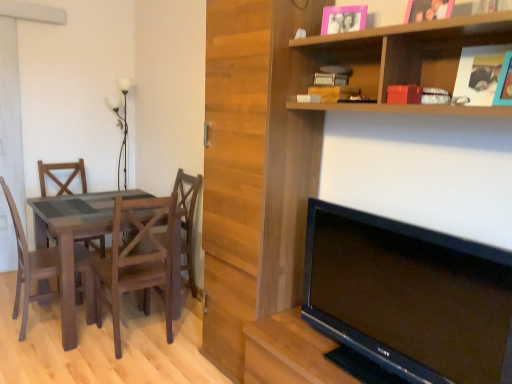
Question: From the image's perspective, does wooden textured chair at left, positioned as the 2th chair in right-to-left order, appear higher than wooden shelf at upper right?

Choices:
 (A) yes
 (B) no

Answer: (B)

Question: From the image's perspective, does wooden textured chair at left, positioned as the 2th chair in right-to-left order, appear lower than wooden shelf at upper right?

Choices:
 (A) yes
 (B) no

Answer: (A)

Question: Could you tell me if wooden textured chair at left, acting as the second chair starting from the left, is facing wooden shelf at upper right?

Choices:
 (A) yes
 (B) no

Answer: (B)

Question: From a real-world perspective, is wooden textured chair at left, acting as the second chair starting from the left, positioned under wooden shelf at upper right based on gravity?

Choices:
 (A) no
 (B) yes

Answer: (B)

Question: Is wooden textured chair at left, acting as the second chair starting from the left, to the left of wooden shelf at upper right from the viewer's perspective?

Choices:
 (A) yes
 (B) no

Answer: (A)

Question: Is point (162, 216) positioned closer to the camera than point (325, 28)?

Choices:
 (A) farther
 (B) closer

Answer: (A)

Question: Is wooden textured chair at left, positioned as the 2th chair in right-to-left order, inside or outside of pink plastic picture frame at upper center, which is counted as the first picture frame, starting from the back?

Choices:
 (A) outside
 (B) inside

Answer: (A)

Question: From the image's perspective, is wooden textured chair at left, positioned as the 2th chair in right-to-left order, above or below pink plastic picture frame at upper center, positioned as the 2th picture frame in front-to-back order?

Choices:
 (A) above
 (B) below

Answer: (B)

Question: Considering their positions, is wooden textured chair at left, positioned as the 2th chair in right-to-left order, located in front of or behind pink plastic picture frame at upper center, positioned as the 2th picture frame in front-to-back order?

Choices:
 (A) behind
 (B) front

Answer: (A)

Question: Considering their positions, is wooden shelf at upper right located in front of or behind white glass lamp at upper left?

Choices:
 (A) behind
 (B) front

Answer: (B)

Question: From the image's perspective, is wooden shelf at upper right above or below white glass lamp at upper left?

Choices:
 (A) below
 (B) above

Answer: (A)

Question: Is wooden shelf at upper right inside or outside of white glass lamp at upper left?

Choices:
 (A) inside
 (B) outside

Answer: (B)

Question: Based on their sizes in the image, would you say wooden shelf at upper right is bigger or smaller than white glass lamp at upper left?

Choices:
 (A) small
 (B) big

Answer: (B)

Question: Looking at their shapes, would you say wooden book at upper center is wider or thinner than wooden shelf at upper right?

Choices:
 (A) thin
 (B) wide

Answer: (A)

Question: Considering the positions of wooden book at upper center and wooden shelf at upper right in the image, is wooden book at upper center bigger or smaller than wooden shelf at upper right?

Choices:
 (A) big
 (B) small

Answer: (B)